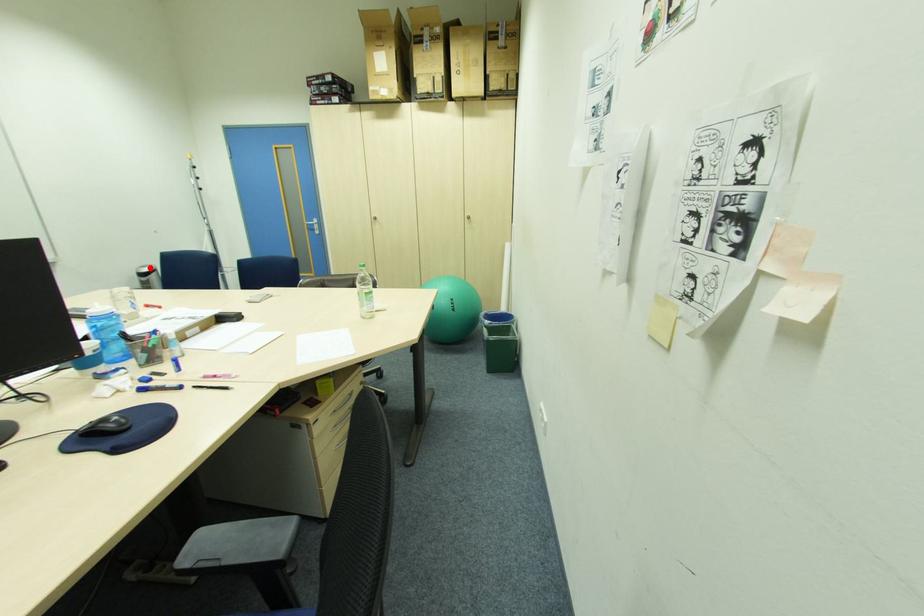
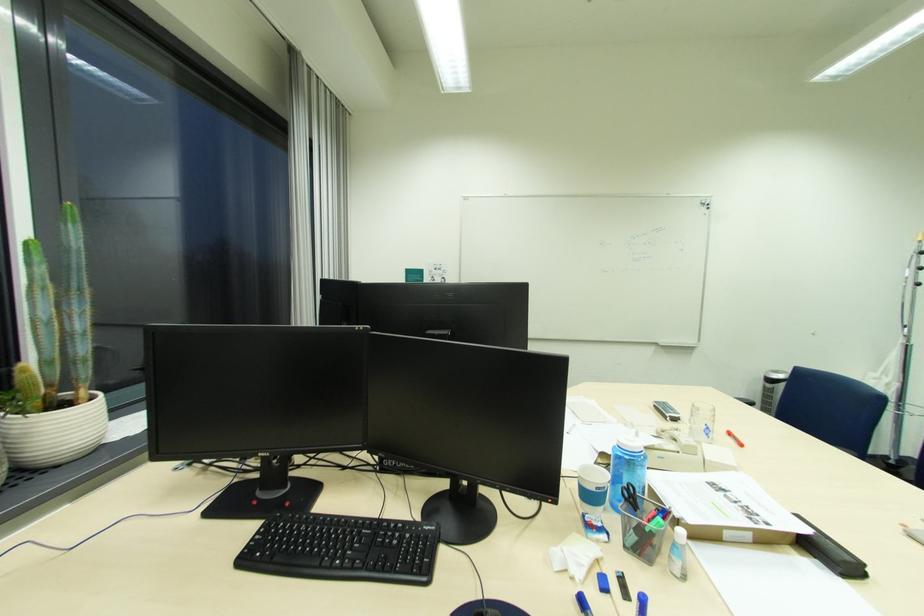
Question: A red point is marked in image1. In image2, is the corresponding 3D point closer to the camera or farther? Reply with the corresponding letter.

Choices:
 (A) The corresponding 3D point is closer.
 (B) The corresponding 3D point is farther.

Answer: (B)